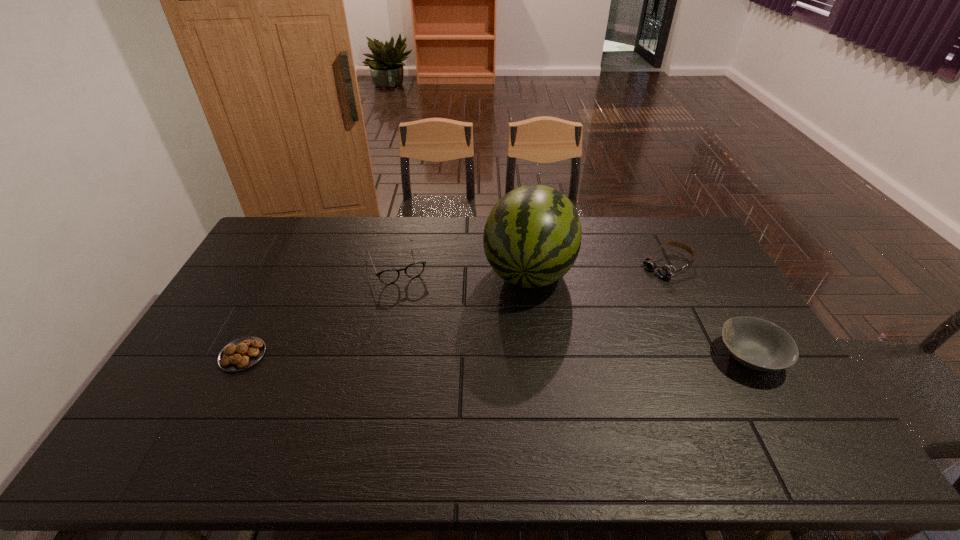
Identify the location of pastry. (242, 353).

Where is `the shortest object`? the shortest object is located at coordinates (242, 353).

At what (x,y) coordinates should I click in order to perform the action: click on the second tallest object. Please return your answer as a coordinate pair (x, y). The image size is (960, 540). Looking at the image, I should click on (758, 344).

At what (x,y) coordinates should I click in order to perform the action: click on goggles. Please return your answer as a coordinate pair (x, y). This screenshot has height=540, width=960. Looking at the image, I should click on (665, 271).

You are a GUI agent. You are given a task and a screenshot of the screen. Output one action in this format:
    pyautogui.click(x=<x>, y=<y>)
    Task: Click on the third object from left to right
    
    Given the screenshot: What is the action you would take?
    pyautogui.click(x=532, y=237)

At what (x,y) coordinates should I click in order to perform the action: click on watermelon. Please return your answer as a coordinate pair (x, y). Looking at the image, I should click on (532, 237).

Find the location of a particular element. Image resolution: width=960 pixels, height=540 pixels. spectacles is located at coordinates (389, 276).

Locate an element on the screen. This screenshot has width=960, height=540. vacant area situated 0.130m on the right of the pastry is located at coordinates (311, 355).

I want to click on free space located on the left of the bowl, so click(x=646, y=357).

Find the location of a particular element. The width and height of the screenshot is (960, 540). vacant area situated 0.290m on the front-facing side of the goggles is located at coordinates (595, 313).